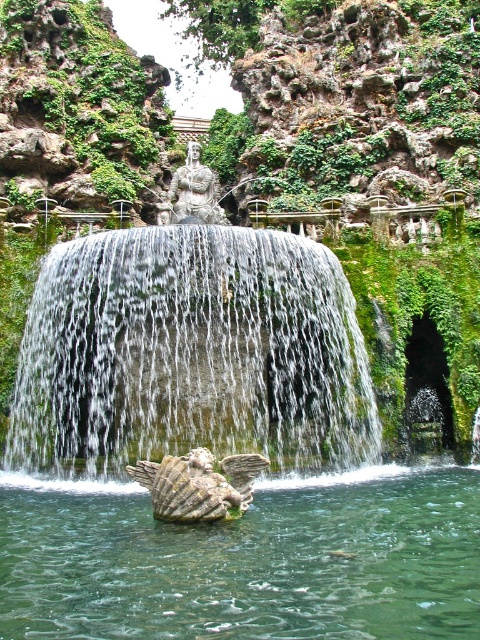
Question: Can you confirm if white textured water at center is smaller than stone winged creature at center?

Choices:
 (A) yes
 (B) no

Answer: (B)

Question: Which object appears farthest from the camera in this image?

Choices:
 (A) stone winged creature at center
 (B) clear stone water at center

Answer: (A)

Question: Can you confirm if white textured water at center is positioned below stone winged creature at center?

Choices:
 (A) no
 (B) yes

Answer: (A)

Question: Is clear stone water at center to the right of stone winged creature at center from the viewer's perspective?

Choices:
 (A) yes
 (B) no

Answer: (A)

Question: Estimate the real-world distances between objects in this image. Which object is farther from the white textured water at center?

Choices:
 (A) clear stone water at center
 (B) stone winged creature at center

Answer: (A)

Question: Which point appears farthest from the camera in this image?

Choices:
 (A) (424, 588)
 (B) (339, 266)
 (C) (145, 467)

Answer: (B)